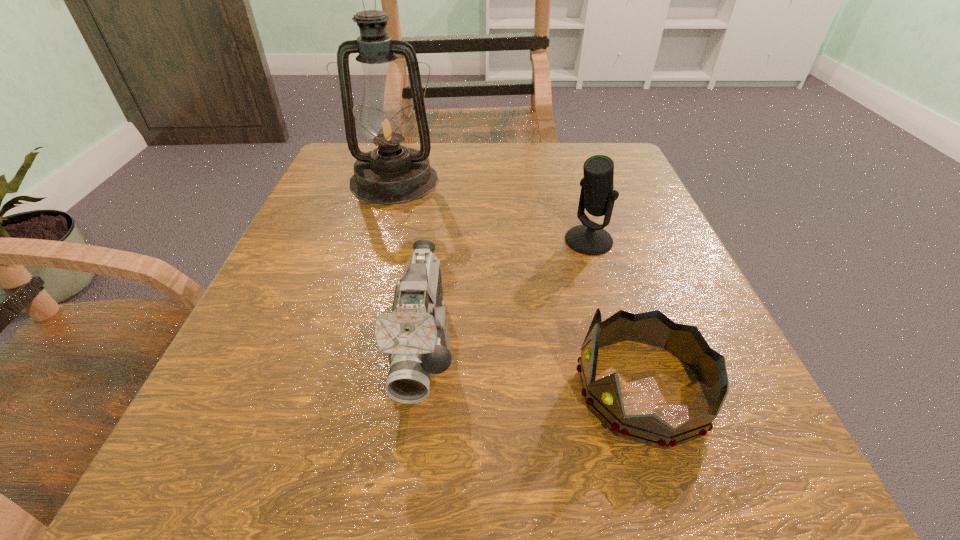
Image resolution: width=960 pixels, height=540 pixels. I want to click on the farthest object, so click(x=390, y=174).

You are a GUI agent. You are given a task and a screenshot of the screen. Output one action in this format:
    pyautogui.click(x=<x>, y=<y>)
    Task: Click on the tallest object
    
    Given the screenshot: What is the action you would take?
    pyautogui.click(x=390, y=174)

Locate an element on the screen. The height and width of the screenshot is (540, 960). the third nearest object is located at coordinates (597, 196).

I want to click on camcorder, so click(x=415, y=335).

Identify the location of tiara. This screenshot has width=960, height=540. (604, 397).

Where is `vacant position located 0.240m on the right of the tallest object`? vacant position located 0.240m on the right of the tallest object is located at coordinates (552, 181).

This screenshot has height=540, width=960. In order to click on free region located 0.110m on the front of the microphone in this screenshot , I will do `click(607, 302)`.

The width and height of the screenshot is (960, 540). What are the coordinates of `blank space located 0.070m on the front-facing side of the camcorder` in the screenshot? It's located at (407, 469).

Locate an element on the screen. The image size is (960, 540). vacant space located 0.230m at the front of the tiara with jewels is located at coordinates (391, 388).

The image size is (960, 540). I want to click on free space located at the front of the tiara with jewels, so click(x=407, y=388).